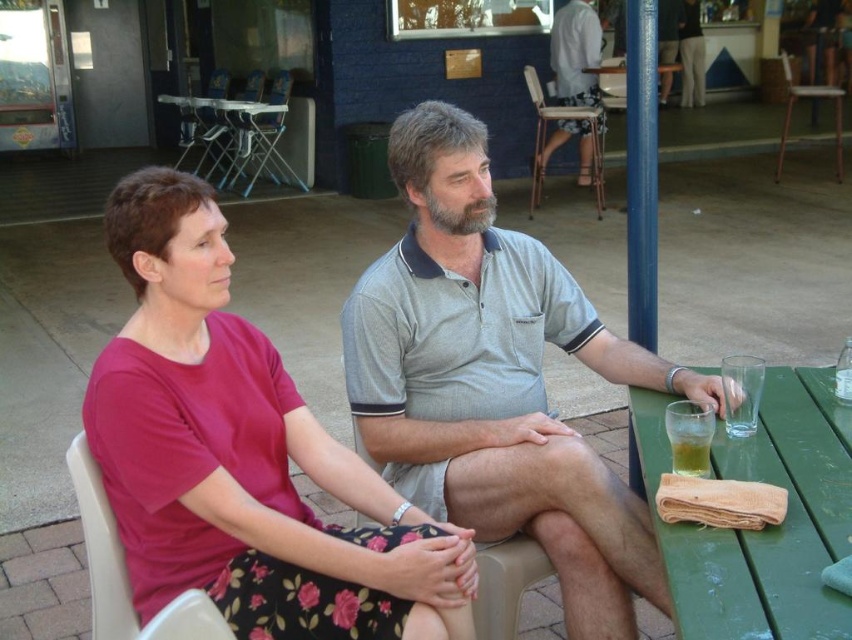
Can you confirm if gray cotton shirt at center is positioned to the right of translucent glass at table right?

Incorrect, gray cotton shirt at center is not on the right side of translucent glass at table right.

Is gray cotton shirt at center bigger than translucent glass at table right?

Yes, gray cotton shirt at center is bigger than translucent glass at table right.

Who is more forward, (509, 234) or (707, 474)?

Point (707, 474) is in front.

I want to click on gray cotton shirt at center, so click(498, 380).

Does gray cotton shirt at center have a greater width compared to green wood table at lower right?

Correct, the width of gray cotton shirt at center exceeds that of green wood table at lower right.

Describe the element at coordinates (498, 380) in the screenshot. I see `gray cotton shirt at center` at that location.

I want to click on gray cotton shirt at center, so click(498, 380).

Does green wood table at lower right have a greater height compared to green plastic picnic table at upper left?

No.

Image resolution: width=852 pixels, height=640 pixels. I want to click on green wood table at lower right, so click(x=763, y=529).

Image resolution: width=852 pixels, height=640 pixels. What do you see at coordinates (763, 529) in the screenshot?
I see `green wood table at lower right` at bounding box center [763, 529].

The image size is (852, 640). Identify the location of green wood table at lower right. (763, 529).